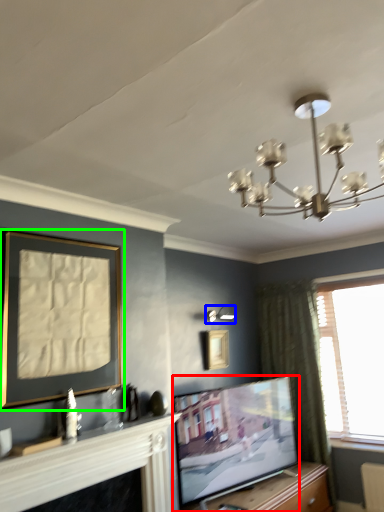
Question: Estimate the real-world distances between objects in this image. Which object is closer to television (highlighted by a red box), lamp (highlighted by a blue box) or picture frame (highlighted by a green box)?

Choices:
 (A) lamp
 (B) picture frame

Answer: (A)